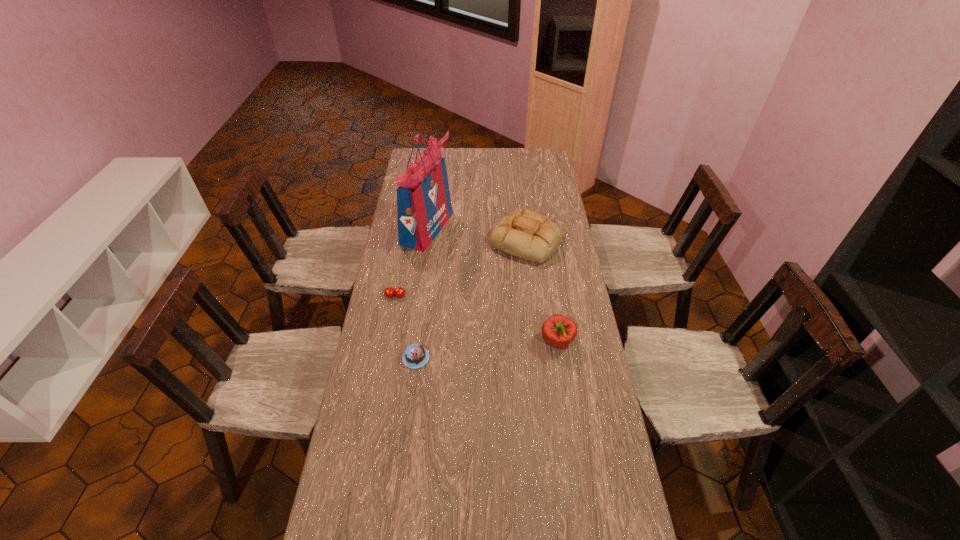
The image size is (960, 540). Find the location of `free spot between the third farthest object and the chocolate cake`. free spot between the third farthest object and the chocolate cake is located at coordinates (406, 327).

Identify the location of free space between the third nearest object and the bell pepper. (476, 319).

The height and width of the screenshot is (540, 960). What are the coordinates of `free space between the third nearest object and the chocolate cake` in the screenshot? It's located at (406, 327).

Identify the location of empty location between the bell pepper and the bread. The image size is (960, 540). (541, 293).

Where is `free space between the bell pepper and the third farthest object`? The image size is (960, 540). free space between the bell pepper and the third farthest object is located at coordinates (476, 319).

The image size is (960, 540). What are the coordinates of `object identified as the fourth closest to the third farthest object` in the screenshot? It's located at (559, 331).

Where is `object that stands as the second closest to the grocery bag`? object that stands as the second closest to the grocery bag is located at coordinates (389, 292).

The height and width of the screenshot is (540, 960). What are the coordinates of `vacant space that satisfies the following two spatial constraints: 1. on the front-facing side of the tallest object; 2. on the left side of the shortest object` in the screenshot? It's located at (410, 358).

The height and width of the screenshot is (540, 960). Identify the location of vacant space that satisfies the following two spatial constraints: 1. with the stems of the cherry pointing upwards; 2. on the right side of the chocolate cake. (384, 358).

Identify the location of vacant area in the image that satisfies the following two spatial constraints: 1. with the stems of the cherry pointing upwards; 2. on the right side of the bell pepper. (387, 342).